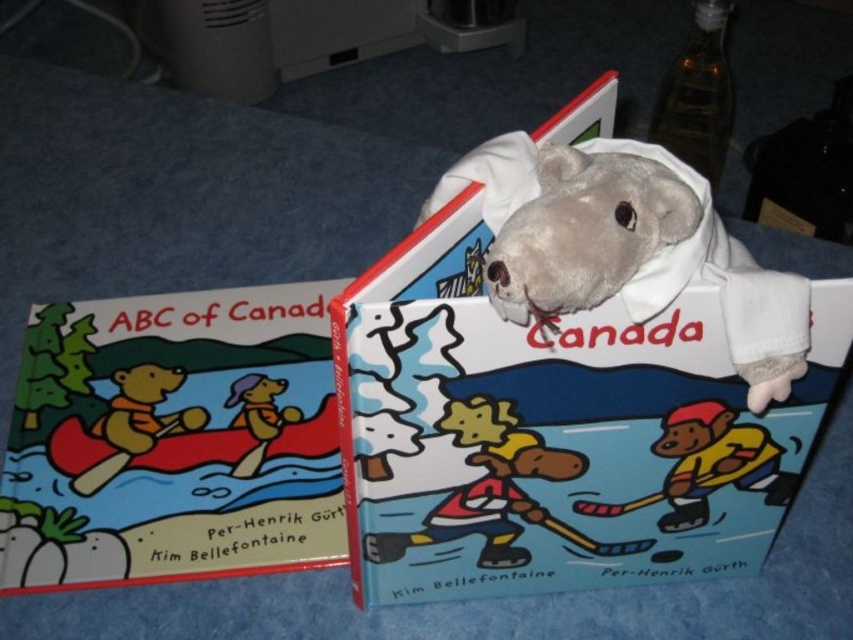
Question: Does gray plush toy at center have a larger size compared to matte plastic hockey player at center?

Choices:
 (A) no
 (B) yes

Answer: (B)

Question: Is the position of matte plastic hockey player at center more distant than that of matte yellow dog at center?

Choices:
 (A) yes
 (B) no

Answer: (B)

Question: Based on their relative distances, which object is farther from the matte plastic hockey player at center?

Choices:
 (A) white soft plush at upper center
 (B) gray plush toy at center

Answer: (B)

Question: Considering the real-world distances, which object is farthest from the matte paper book at left?

Choices:
 (A) brown plush bear at left
 (B) matte yellow dog at center
 (C) matte plastic hockey player at center
 (D) white soft plush at upper center

Answer: (C)

Question: Based on their relative distances, which object is farther from the matte plastic hockey player at center?

Choices:
 (A) white soft plush at upper center
 (B) gray plush toy at center
 (C) matte yellow dog at center

Answer: (C)

Question: Does brown plush bear at left have a larger size compared to matte yellow dog at center?

Choices:
 (A) no
 (B) yes

Answer: (B)